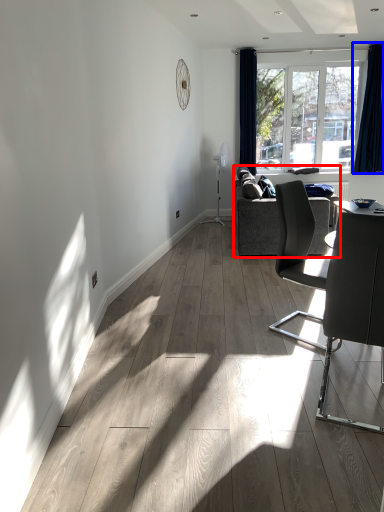
Question: Which point is further to the camera, studio couch (highlighted by a red box) or curtain (highlighted by a blue box)?

Choices:
 (A) studio couch
 (B) curtain

Answer: (B)